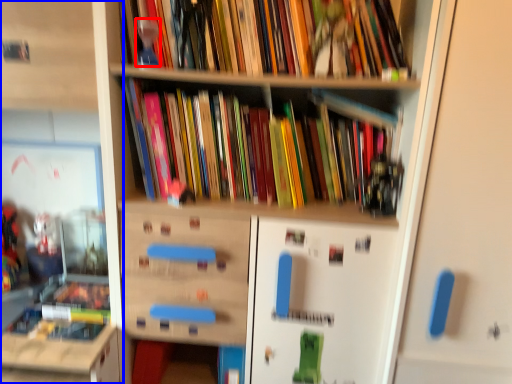
Question: Which point is further to the camera, toy (highlighted by a red box) or shelf (highlighted by a blue box)?

Choices:
 (A) toy
 (B) shelf

Answer: (A)